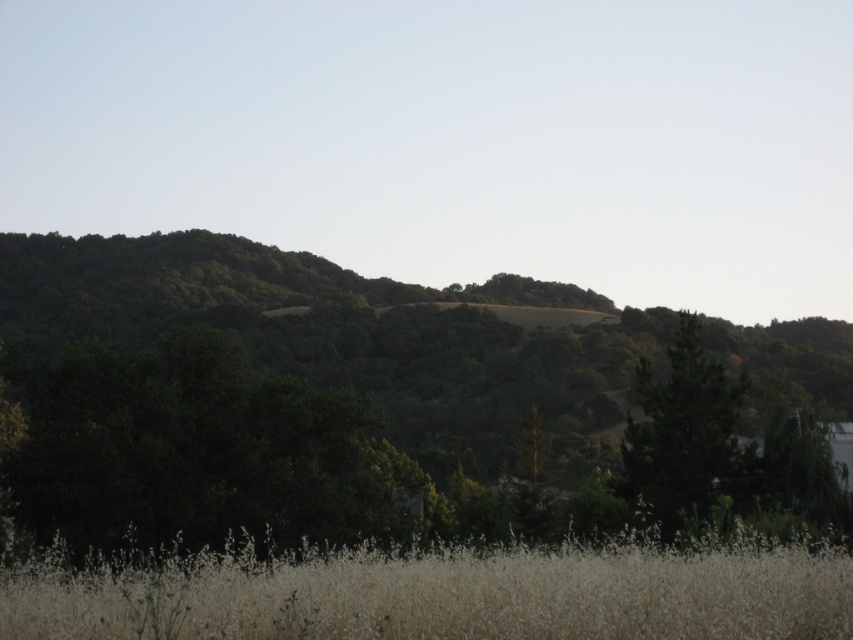
Is green leafy tree at center to the right of white soft grass at lower center from the viewer's perspective?

Indeed, green leafy tree at center is positioned on the right side of white soft grass at lower center.

Who is lower down, green leafy tree at center or white soft grass at lower center?

green leafy tree at center is lower down.

Find the location of a particular element. The image size is (853, 640). green leafy tree at center is located at coordinates (379, 403).

Where is `green leafy tree at center`? green leafy tree at center is located at coordinates (379, 403).

Between white soft grass at lower center and green matte tree at right, which one appears on the right side from the viewer's perspective?

green matte tree at right is more to the right.

Does white soft grass at lower center appear under green matte tree at right?

Incorrect, white soft grass at lower center is not positioned below green matte tree at right.

Locate an element on the screen. white soft grass at lower center is located at coordinates (440, 595).

Does green leafy tree at center appear on the right side of green matte tree at right?

Incorrect, green leafy tree at center is not on the right side of green matte tree at right.

Is point (653, 438) closer to camera compared to point (712, 374)?

That is True.

Which is behind, point (201, 504) or point (662, 497)?

Point (662, 497)

Identify the location of green leafy tree at center. (379, 403).